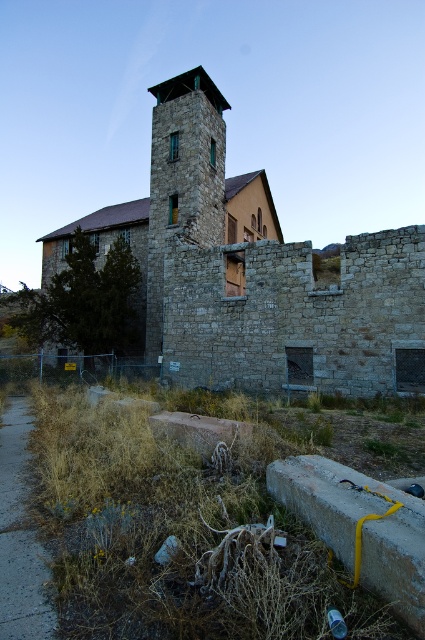
Can you confirm if stone brick fort at center is thinner than stone tower at center?

Incorrect, stone brick fort at center's width is not less than stone tower at center's.

Is point (405, 308) farther from viewer compared to point (158, 298)?

No, (405, 308) is closer to viewer.

Which is in front, point (244, 189) or point (178, 173)?

Positioned in front is point (178, 173).

Locate an element on the screen. stone brick fort at center is located at coordinates (252, 272).